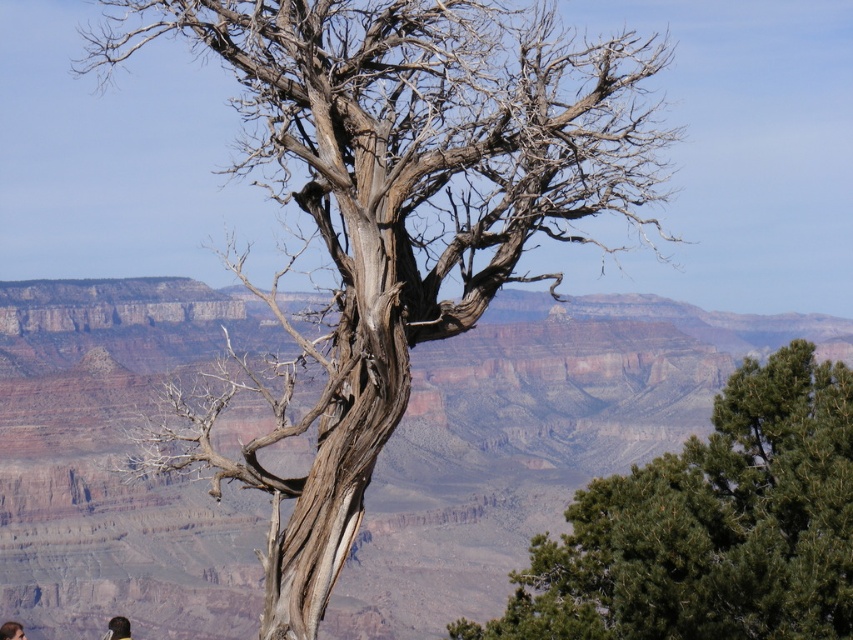
Question: Can you confirm if gray bark tree at center is positioned below dark brown hair at lower left?

Choices:
 (A) yes
 (B) no

Answer: (B)

Question: Considering the real-world distances, which object is farthest from the gray bark tree at center?

Choices:
 (A) black fabric head at lower left
 (B) green textured pine tree at center
 (C) dark brown hair at lower left

Answer: (C)

Question: Does green textured pine tree at center have a lesser width compared to dark brown hair at lower left?

Choices:
 (A) no
 (B) yes

Answer: (B)

Question: Is green textured pine tree at center thinner than dark brown hair at lower left?

Choices:
 (A) yes
 (B) no

Answer: (A)

Question: Which is farther from the black fabric head at lower left?

Choices:
 (A) dark brown hair at lower left
 (B) green textured pine tree at center

Answer: (B)

Question: Which point appears closest to the camera in this image?

Choices:
 (A) (119, 634)
 (B) (822, 410)
 (C) (114, 33)
 (D) (21, 636)

Answer: (B)